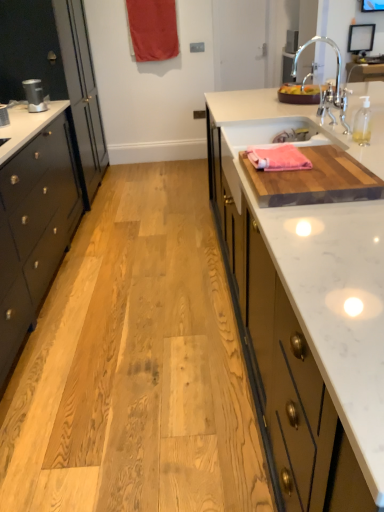
What do you see at coordinates (336, 75) in the screenshot? Image resolution: width=384 pixels, height=512 pixels. I see `chrome metallic faucet at upper right` at bounding box center [336, 75].

Measure the distance between white ceramic sink at upper right and camera.

A distance of 1.82 meters exists between white ceramic sink at upper right and camera.

This screenshot has width=384, height=512. I want to click on white ceramic sink at upper right, so click(x=271, y=120).

What is the approximate width of white marble countertop at right?

The width of white marble countertop at right is 4.48 feet.

Find the location of `matte black speaker at left`. matte black speaker at left is located at coordinates (34, 95).

Where is `chrome metallic faucet at upper right`? The height and width of the screenshot is (512, 384). chrome metallic faucet at upper right is located at coordinates (336, 75).

Considering the relative sizes of pink woven towel at upper right and matte black speaker at left in the image provided, is pink woven towel at upper right shorter than matte black speaker at left?

Yes.

Locate an element on the screen. This screenshot has width=384, height=512. material in front of the matte black speaker at left is located at coordinates (278, 158).

From the image's perspective, which object appears higher, pink woven towel at upper right or matte black speaker at left?

matte black speaker at left, from the image's perspective.

Is black glossy cabinet at left far from chrome metallic faucet at upper right?

Yes, black glossy cabinet at left is far from chrome metallic faucet at upper right.

Looking at this image, considering the relative sizes of black glossy cabinet at left and chrome metallic faucet at upper right in the image provided, is black glossy cabinet at left bigger than chrome metallic faucet at upper right?

Correct, black glossy cabinet at left is larger in size than chrome metallic faucet at upper right.

Consider the image. Is white marble countertop at right aimed at matte black speaker at left?

No, white marble countertop at right is not facing towards matte black speaker at left.

Between white marble countertop at right and matte black speaker at left, which one has less height?

With less height is matte black speaker at left.

Can you confirm if white marble countertop at right is positioned to the left of matte black speaker at left?

In fact, white marble countertop at right is to the right of matte black speaker at left.

Is white ceramic sink at upper right turned away from white marble countertop at right?

white ceramic sink at upper right does not have its back to white marble countertop at right.

From a real-world perspective, is white ceramic sink at upper right physically above white marble countertop at right?

Yes, from a real-world perspective, white ceramic sink at upper right is over white marble countertop at right

Is the surface of white ceramic sink at upper right in direct contact with white marble countertop at right?

Indeed, white ceramic sink at upper right and white marble countertop at right are beside each other and touching.

From a real-world perspective, between pink woven towel at upper right and white ceramic sink at upper right, who is vertically lower?

white ceramic sink at upper right is physically lower.

From the image's perspective, which one is positioned lower, pink woven towel at upper right or white ceramic sink at upper right?

pink woven towel at upper right is shown below in the image.

Find the location of a particular element. sink on the right of pink woven towel at upper right is located at coordinates (271, 120).

Does point (296, 166) come farther from viewer compared to point (280, 132)?

No, (296, 166) is closer to viewer.

How many degrees apart are the facing directions of matte black speaker at left and chrome metallic faucet at upper right?

The facing directions of matte black speaker at left and chrome metallic faucet at upper right are 140 degrees apart.

Consider the image. Is matte black speaker at left wider than chrome metallic faucet at upper right?

In fact, matte black speaker at left might be narrower than chrome metallic faucet at upper right.

Between point (34, 88) and point (291, 72), which one is positioned behind?

The point (291, 72) is farther from the camera.

Which is nearer, (294,162) or (312,206)?

Point (294,162) is positioned farther from the camera compared to point (312,206).

This screenshot has height=512, width=384. Identify the location of material that appears above the white marble countertop at right (from a real-world perspective). (278, 158).

Is pink woven towel at upper right beside white marble countertop at right?

No.

This screenshot has width=384, height=512. Find the location of `material beneath the matte black speaker at left (from a real-world perspective)`. material beneath the matte black speaker at left (from a real-world perspective) is located at coordinates 278,158.

The image size is (384, 512). Identify the location of cabinetry in front of the chrome metallic faucet at upper right. (34, 230).

Consider the image. From the image, which object appears to be farther from red fabric curtain at upper center, matte black speaker at left or chrome metallic faucet at upper right?

matte black speaker at left is positioned further to the anchor red fabric curtain at upper center.

Considering their positions, is matte black speaker at left positioned further to red fabric curtain at upper center than white ceramic sink at upper right?

matte black speaker at left is further to red fabric curtain at upper center.

Estimate the real-world distances between objects in this image. Which object is further from chrome metallic faucet at upper right, black glossy cabinet at left or white ceramic sink at upper right?

Among the two, black glossy cabinet at left is located further to chrome metallic faucet at upper right.

Which object lies nearer to the anchor point red fabric curtain at upper center, chrome metallic faucet at upper right or pink woven towel at upper right?

The object closer to red fabric curtain at upper center is chrome metallic faucet at upper right.

Which object lies further to the anchor point red fabric curtain at upper center, matte black speaker at left or pink woven towel at upper right?

Among the two, pink woven towel at upper right is located further to red fabric curtain at upper center.

From the picture: Which object lies further to the anchor point chrome metallic faucet at upper right, matte black speaker at left or red fabric curtain at upper center?

matte black speaker at left is further to chrome metallic faucet at upper right.

When comparing their distances from white marble countertop at right, does chrome metallic faucet at upper right or black glossy cabinet at left seem further?

Among the two, chrome metallic faucet at upper right is located further to white marble countertop at right.

When comparing their distances from red fabric curtain at upper center, does matte black speaker at left or white marble countertop at right seem further?

The object further to red fabric curtain at upper center is white marble countertop at right.

Identify the location of cabinetry between white marble countertop at right and white ceramic sink at upper right from front to back. Image resolution: width=384 pixels, height=512 pixels. (34, 230).

The width and height of the screenshot is (384, 512). What are the coordinates of `material situated between matte black speaker at left and chrome metallic faucet at upper right from left to right` in the screenshot? It's located at (278, 158).

The image size is (384, 512). I want to click on tap located between black glossy cabinet at left and white marble countertop at right in the left-right direction, so click(336, 75).

Locate an element on the screen. This screenshot has height=512, width=384. material positioned between white marble countertop at right and white ceramic sink at upper right from near to far is located at coordinates (278, 158).